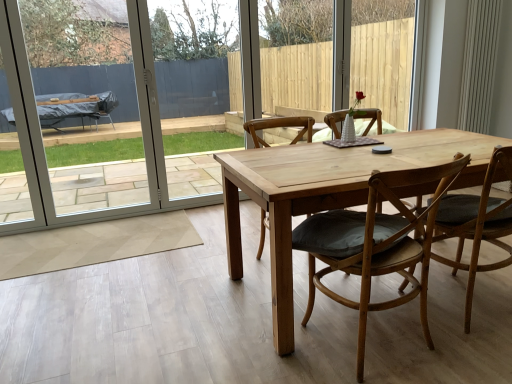
At what (x,y) coordinates should I click in order to perform the action: click on vacant area that lies between white plastic screen door at left and wooden chair with cushion at center, the second chair from the right. Please return your answer as a coordinate pair (x, y). Looking at the image, I should click on (172, 258).